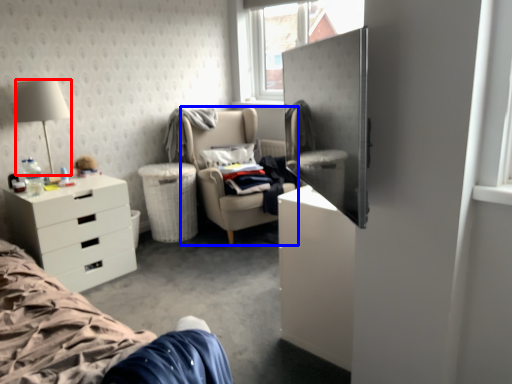
Question: Which of the following is the closest to the observer, lamp (highlighted by a red box) or chair (highlighted by a blue box)?

Choices:
 (A) lamp
 (B) chair

Answer: (A)